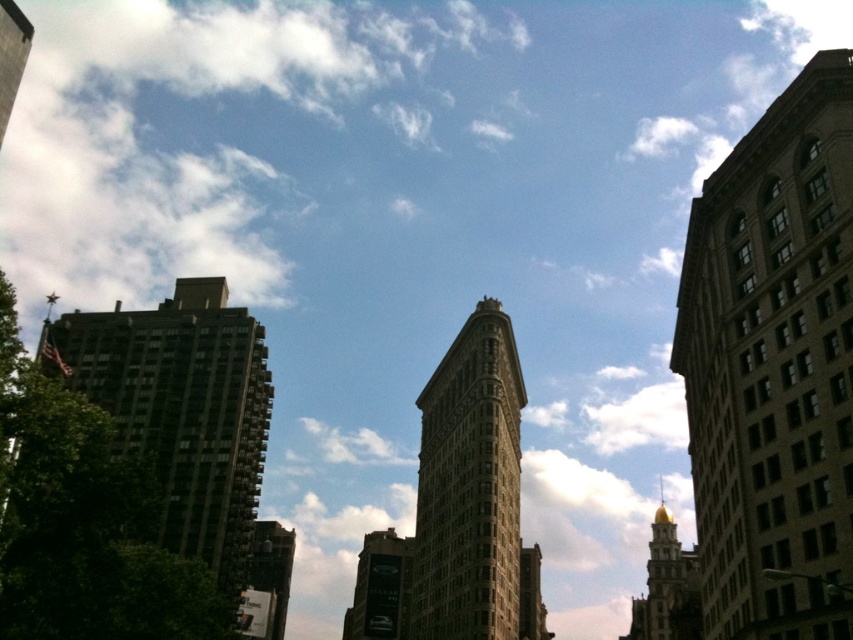
Question: Which object is positioned closest to the dark gray concrete building at left?

Choices:
 (A) gold polished dome at upper right
 (B) brown brick building at right

Answer: (B)

Question: Estimate the real-world distances between objects in this image. Which object is farther from the brown stone building at center?

Choices:
 (A) brown brick building at right
 (B) brick textured building at center
 (C) dark gray concrete building at left

Answer: (C)

Question: Is dark gray concrete building at left bigger than gold polished dome at upper right?

Choices:
 (A) no
 (B) yes

Answer: (A)

Question: Does brown stone building at center come behind gold polished dome at upper right?

Choices:
 (A) yes
 (B) no

Answer: (B)

Question: Does brown brick building at right come behind gold polished dome at upper right?

Choices:
 (A) yes
 (B) no

Answer: (B)

Question: Estimate the real-world distances between objects in this image. Which object is closer to the dark gray concrete building at left?

Choices:
 (A) brick textured building at center
 (B) brown stone building at center

Answer: (A)